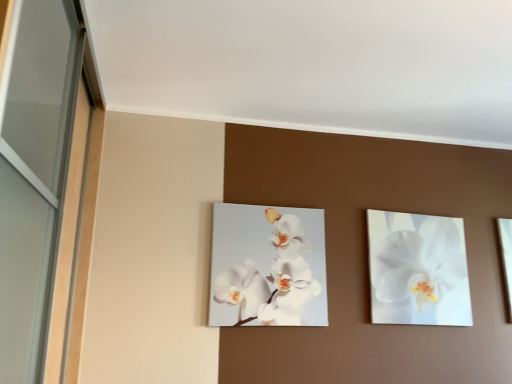
The width and height of the screenshot is (512, 384). Identify the location of white glossy orchid at center, which is counted as the first flower, starting from the left. (268, 266).

This screenshot has width=512, height=384. Describe the element at coordinates (268, 266) in the screenshot. I see `white glossy orchid at center, acting as the 2th flower starting from the right` at that location.

In order to face white glossy orchid at center, acting as the 2th flower starting from the right, should I rotate leftwards or rightwards?

Rotate your view right by about 2.138°.

The height and width of the screenshot is (384, 512). What are the coordinates of `white glossy orchid at upper right, the second flower in the left-to-right sequence` in the screenshot? It's located at (420, 262).

Consider the image. What is the approximate height of white glossy orchid at upper right, the second flower in the left-to-right sequence?

It is 56.73 centimeters.

Describe the element at coordinates (420, 262) in the screenshot. Image resolution: width=512 pixels, height=384 pixels. I see `white glossy orchid at upper right, the second flower in the left-to-right sequence` at that location.

Identify the location of white glossy orchid at center, which is counted as the first flower, starting from the left. (268, 266).

In the image, is white glossy orchid at upper right, positioned as the first flower in right-to-left order, on the left side or the right side of white glossy orchid at center, which is counted as the first flower, starting from the left?

Based on their positions, white glossy orchid at upper right, positioned as the first flower in right-to-left order, is located to the right of white glossy orchid at center, which is counted as the first flower, starting from the left.

Does white glossy orchid at upper right, the second flower in the left-to-right sequence, lie in front of white glossy orchid at center, which is counted as the first flower, starting from the left?

No, it is not.

Does point (438, 245) come closer to viewer compared to point (219, 229)?

No.

From the image's perspective, is white glossy orchid at upper right, positioned as the first flower in right-to-left order, over white glossy orchid at center, which is counted as the first flower, starting from the left?

Actually, white glossy orchid at upper right, positioned as the first flower in right-to-left order, appears below white glossy orchid at center, which is counted as the first flower, starting from the left, in the image.

From a real-world perspective, is white glossy orchid at upper right, positioned as the first flower in right-to-left order, above or below white glossy orchid at center, acting as the 2th flower starting from the right?

In terms of real-world spatial position, white glossy orchid at upper right, positioned as the first flower in right-to-left order, is above white glossy orchid at center, acting as the 2th flower starting from the right.

Considering the sizes of objects white glossy orchid at upper right, the second flower in the left-to-right sequence, and white glossy orchid at center, acting as the 2th flower starting from the right, in the image provided, who is wider, white glossy orchid at upper right, the second flower in the left-to-right sequence, or white glossy orchid at center, acting as the 2th flower starting from the right,?

white glossy orchid at upper right, the second flower in the left-to-right sequence.

Is white glossy orchid at upper right, the second flower in the left-to-right sequence, shorter than white glossy orchid at center, which is counted as the first flower, starting from the left?

No.

Considering the sizes of objects white glossy orchid at upper right, the second flower in the left-to-right sequence, and white glossy orchid at center, acting as the 2th flower starting from the right, in the image provided, who is smaller, white glossy orchid at upper right, the second flower in the left-to-right sequence, or white glossy orchid at center, acting as the 2th flower starting from the right,?

white glossy orchid at center, acting as the 2th flower starting from the right.

Based on the photo, is white glossy orchid at upper right, positioned as the first flower in right-to-left order, spatially inside white glossy orchid at center, which is counted as the first flower, starting from the left, or outside of it?

white glossy orchid at upper right, positioned as the first flower in right-to-left order, is not enclosed by white glossy orchid at center, which is counted as the first flower, starting from the left.

Does white glossy orchid at upper right, positioned as the first flower in right-to-left order, touch white glossy orchid at center, acting as the 2th flower starting from the right?

No, white glossy orchid at upper right, positioned as the first flower in right-to-left order, is not next to white glossy orchid at center, acting as the 2th flower starting from the right.

Could you tell me if white glossy orchid at upper right, positioned as the first flower in right-to-left order, is turned towards white glossy orchid at center, which is counted as the first flower, starting from the left?

No, white glossy orchid at upper right, positioned as the first flower in right-to-left order, does not turn towards white glossy orchid at center, which is counted as the first flower, starting from the left.

How many degrees apart are the facing directions of white glossy orchid at upper right, positioned as the first flower in right-to-left order, and white glossy orchid at center, which is counted as the first flower, starting from the left?

white glossy orchid at upper right, positioned as the first flower in right-to-left order, and white glossy orchid at center, which is counted as the first flower, starting from the left, are facing 0.0178 degrees away from each other.

The image size is (512, 384). I want to click on flower directly beneath the white glossy orchid at upper right, the second flower in the left-to-right sequence (from a real-world perspective), so click(268, 266).

Consider the image. Is white glossy orchid at center, which is counted as the first flower, starting from the left, to the left of white glossy orchid at upper right, positioned as the first flower in right-to-left order, from the viewer's perspective?

Yes.

Consider the image. Which object is more forward, white glossy orchid at center, acting as the 2th flower starting from the right, or white glossy orchid at upper right, positioned as the first flower in right-to-left order?

white glossy orchid at center, acting as the 2th flower starting from the right.

Does point (209, 318) come in front of point (428, 255)?

Yes, it is in front of point (428, 255).

From the image's perspective, is white glossy orchid at center, acting as the 2th flower starting from the right, under white glossy orchid at upper right, the second flower in the left-to-right sequence?

No.

From a real-world perspective, which is physically below, white glossy orchid at center, acting as the 2th flower starting from the right, or white glossy orchid at upper right, positioned as the first flower in right-to-left order?

From a 3D spatial view, white glossy orchid at center, acting as the 2th flower starting from the right, is below.

Does white glossy orchid at center, which is counted as the first flower, starting from the left, have a greater width compared to white glossy orchid at upper right, positioned as the first flower in right-to-left order?

In fact, white glossy orchid at center, which is counted as the first flower, starting from the left, might be narrower than white glossy orchid at upper right, positioned as the first flower in right-to-left order.

Is white glossy orchid at center, acting as the 2th flower starting from the right, taller or shorter than white glossy orchid at upper right, positioned as the first flower in right-to-left order?

Considering their sizes, white glossy orchid at center, acting as the 2th flower starting from the right, has less height than white glossy orchid at upper right, positioned as the first flower in right-to-left order.

Between white glossy orchid at center, acting as the 2th flower starting from the right, and white glossy orchid at upper right, positioned as the first flower in right-to-left order, which one has larger size?

white glossy orchid at upper right, positioned as the first flower in right-to-left order, is bigger.

Would you say white glossy orchid at center, which is counted as the first flower, starting from the left, is inside or outside white glossy orchid at upper right, positioned as the first flower in right-to-left order?

white glossy orchid at center, which is counted as the first flower, starting from the left, is located beyond the bounds of white glossy orchid at upper right, positioned as the first flower in right-to-left order.

Are white glossy orchid at center, acting as the 2th flower starting from the right, and white glossy orchid at upper right, the second flower in the left-to-right sequence, beside each other?

There is a gap between white glossy orchid at center, acting as the 2th flower starting from the right, and white glossy orchid at upper right, the second flower in the left-to-right sequence.

Is white glossy orchid at upper right, positioned as the first flower in right-to-left order, at the back of white glossy orchid at center, acting as the 2th flower starting from the right?

white glossy orchid at center, acting as the 2th flower starting from the right, does not have its back to white glossy orchid at upper right, positioned as the first flower in right-to-left order.

The image size is (512, 384). Find the location of `flower above the white glossy orchid at center, which is counted as the first flower, starting from the left (from a real-world perspective)`. flower above the white glossy orchid at center, which is counted as the first flower, starting from the left (from a real-world perspective) is located at coordinates (420, 262).

Locate an element on the screen. flower that appears on the left of white glossy orchid at upper right, positioned as the first flower in right-to-left order is located at coordinates (268, 266).

Find the location of `flower above the white glossy orchid at center, acting as the 2th flower starting from the right (from a real-world perspective)`. flower above the white glossy orchid at center, acting as the 2th flower starting from the right (from a real-world perspective) is located at coordinates (420, 262).